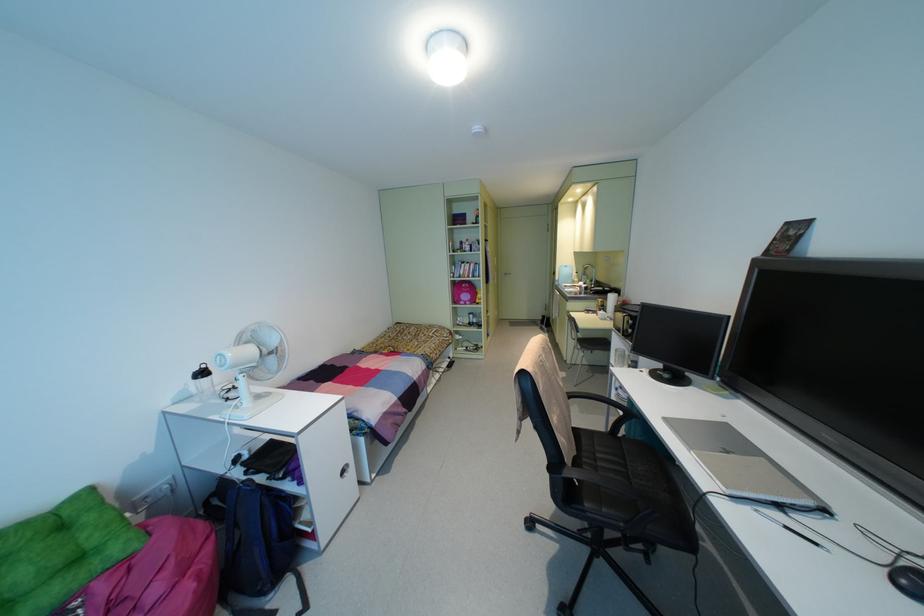
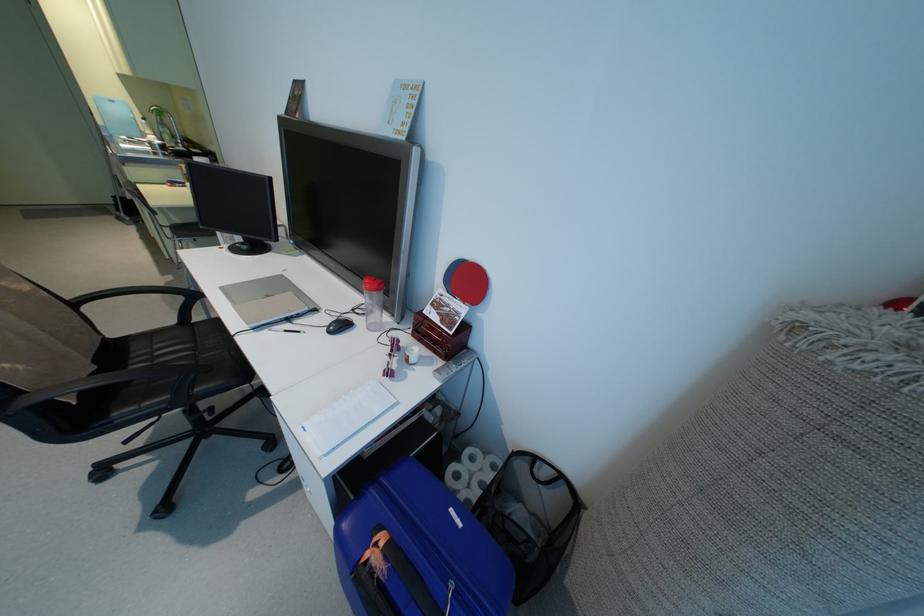
How did the camera likely rotate?

The camera rotated toward right-down.